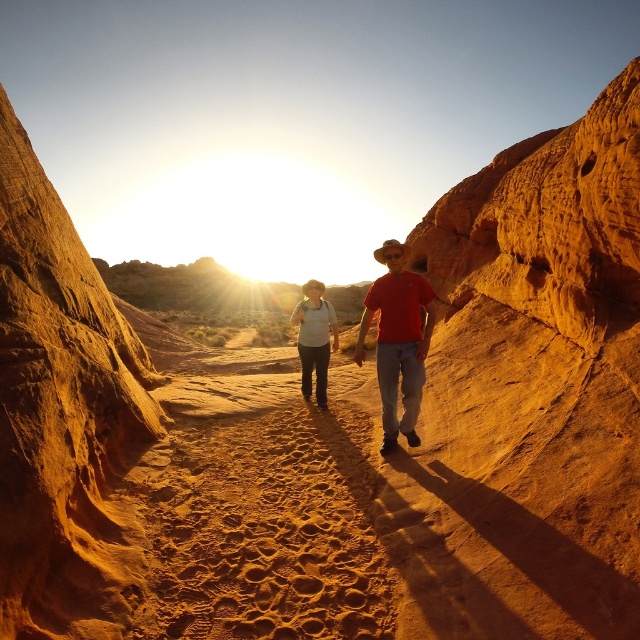
Does matte red shirt at center have a lesser height compared to matte white shirt at center?

No, matte red shirt at center is not shorter than matte white shirt at center.

Between point (387, 422) and point (304, 284), which one is positioned behind?

Point (304, 284)

Locate an element on the screen. The image size is (640, 640). matte red shirt at center is located at coordinates (397, 340).

Looking at this image, does smooth sandstone rock at left have a greater height compared to matte white shirt at center?

Yes, smooth sandstone rock at left is taller than matte white shirt at center.

Is point (40, 220) more distant than point (298, 342)?

No, (40, 220) is in front of (298, 342).

The height and width of the screenshot is (640, 640). What are the coordinates of `smooth sandstone rock at left` in the screenshot? It's located at (61, 413).

Which is more to the left, smooth sandstone rock at left or matte red shirt at center?

From the viewer's perspective, smooth sandstone rock at left appears more on the left side.

The height and width of the screenshot is (640, 640). What do you see at coordinates (61, 413) in the screenshot?
I see `smooth sandstone rock at left` at bounding box center [61, 413].

What are the coordinates of `smooth sandstone rock at left` in the screenshot? It's located at (61, 413).